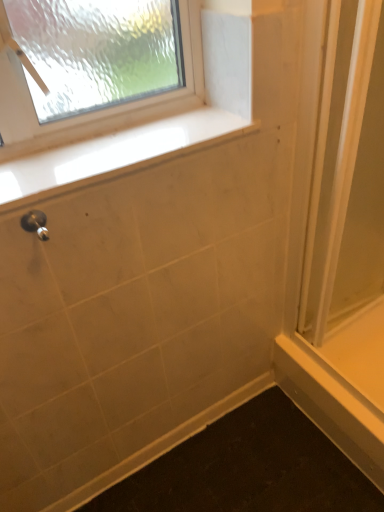
The image size is (384, 512). In order to click on matte silver shower at lower left in this screenshot , I will do (x=36, y=224).

Measure the distance between point (x=42, y=232) and camera.

Point (x=42, y=232) and camera are 30.39 inches apart.

Image resolution: width=384 pixels, height=512 pixels. In order to click on white glossy window sill at upper center in this screenshot , I will do `click(112, 154)`.

Find the location of `clear plastic screen door at right`. clear plastic screen door at right is located at coordinates (347, 173).

Identify the location of screen door below the white glossy window sill at upper center (from the image's perspective). The height and width of the screenshot is (512, 384). coord(347,173).

Would you say clear plastic screen door at right is inside or outside white glossy window sill at upper center?

clear plastic screen door at right cannot be found inside white glossy window sill at upper center.

Is clear plastic screen door at right oriented away from white glossy window sill at upper center?

No, clear plastic screen door at right is not facing away from white glossy window sill at upper center.

From their relative heights in the image, would you say clear plastic screen door at right is taller or shorter than white glossy window sill at upper center?

In the image, clear plastic screen door at right appears to be taller than white glossy window sill at upper center.

Between matte silver shower at lower left and white glossy window sill at upper center, which one has less height?

white glossy window sill at upper center is shorter.

Considering the relative sizes of matte silver shower at lower left and white glossy window sill at upper center in the image provided, is matte silver shower at lower left wider than white glossy window sill at upper center?

No, matte silver shower at lower left is not wider than white glossy window sill at upper center.

Is matte silver shower at lower left positioned far away from white glossy window sill at upper center?

No, matte silver shower at lower left is in close proximity to white glossy window sill at upper center.

Considering the points (29, 223) and (237, 118), which point is in front, point (29, 223) or point (237, 118)?

The point (29, 223) is closer to the camera.

Which object is more forward, matte silver shower at lower left or clear plastic screen door at right?

matte silver shower at lower left.

Is matte silver shower at lower left oriented towards clear plastic screen door at right?

No.

Does matte silver shower at lower left have a greater width compared to clear plastic screen door at right?

No.

What's the angular difference between matte silver shower at lower left and clear plastic screen door at right's facing directions?

The angular difference between matte silver shower at lower left and clear plastic screen door at right is 2.68 degrees.

Considering the relative sizes of white glossy window sill at upper center and matte silver shower at lower left in the image provided, is white glossy window sill at upper center thinner than matte silver shower at lower left?

No, white glossy window sill at upper center is not thinner than matte silver shower at lower left.

Is white glossy window sill at upper center further to the viewer compared to matte silver shower at lower left?

Yes, white glossy window sill at upper center is further from the camera.

Is point (146, 148) less distant than point (24, 221)?

That is False.

Identify the location of shower below the white glossy window sill at upper center (from the image's perspective). The image size is (384, 512). (36, 224).

Which of these two, white glossy window sill at upper center or clear plastic screen door at right, is wider?

With larger width is white glossy window sill at upper center.

Does white glossy window sill at upper center appear on the left side of clear plastic screen door at right?

Correct, you'll find white glossy window sill at upper center to the left of clear plastic screen door at right.

From the picture: How far apart are white glossy window sill at upper center and clear plastic screen door at right?

A distance of 19.85 inches exists between white glossy window sill at upper center and clear plastic screen door at right.

In terms of size, does white glossy window sill at upper center appear bigger or smaller than clear plastic screen door at right?

white glossy window sill at upper center is smaller than clear plastic screen door at right.

Considering the positions of objects clear plastic screen door at right and matte silver shower at lower left in the image provided, who is in front, clear plastic screen door at right or matte silver shower at lower left?

matte silver shower at lower left.

Which point is more forward, [378,38] or [46,234]?

The point [46,234] is in front.

Is matte silver shower at lower left at the back of clear plastic screen door at right?

clear plastic screen door at right does not have its back to matte silver shower at lower left.

Is clear plastic screen door at right far from matte silver shower at lower left?

clear plastic screen door at right is actually quite close to matte silver shower at lower left.

Locate an element on the screen. The width and height of the screenshot is (384, 512). screen door located below the white glossy window sill at upper center (from the image's perspective) is located at coordinates tap(347, 173).

In order to click on window sill lying above the matte silver shower at lower left (from the image's perspective) in this screenshot , I will do `click(112, 154)`.

Estimate the real-world distances between objects in this image. Which object is further from white glossy window sill at upper center, clear plastic screen door at right or matte silver shower at lower left?

The object further to white glossy window sill at upper center is clear plastic screen door at right.

Which object lies further to the anchor point white glossy window sill at upper center, matte silver shower at lower left or clear plastic screen door at right?

Based on the image, clear plastic screen door at right appears to be further to white glossy window sill at upper center.

Which object lies further to the anchor point clear plastic screen door at right, white glossy window sill at upper center or matte silver shower at lower left?

Based on the image, matte silver shower at lower left appears to be further to clear plastic screen door at right.

Which object lies further to the anchor point matte silver shower at lower left, clear plastic screen door at right or white glossy window sill at upper center?

Based on the image, clear plastic screen door at right appears to be further to matte silver shower at lower left.

From the image, which object appears to be farther from matte silver shower at lower left, white glossy window sill at upper center or clear plastic screen door at right?

Among the two, clear plastic screen door at right is located further to matte silver shower at lower left.

Considering their positions, is matte silver shower at lower left positioned closer to clear plastic screen door at right than white glossy window sill at upper center?

white glossy window sill at upper center is closer to clear plastic screen door at right.

Where is `window sill situated between matte silver shower at lower left and clear plastic screen door at right from left to right`? window sill situated between matte silver shower at lower left and clear plastic screen door at right from left to right is located at coordinates (112, 154).